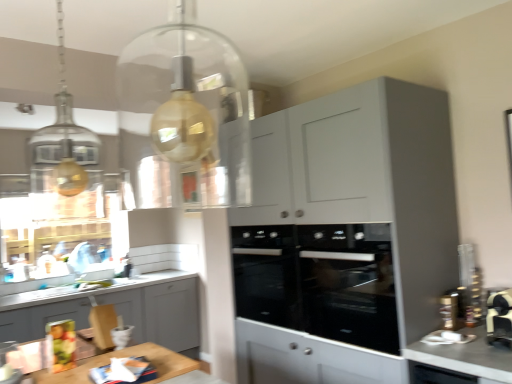
The width and height of the screenshot is (512, 384). Identify the location of matte gray cabinet at upper right, the second cabinetry in the back-to-front sequence. (345, 236).

Describe the element at coordinates (466, 357) in the screenshot. I see `white glossy countertop at lower right` at that location.

You are a GUI agent. You are given a task and a screenshot of the screen. Output one action in this format:
    pyautogui.click(x=<x>, y=<y>)
    Task: Click on the matte gray cabinet at lower left, which ranks as the 2th cabinetry in right-to-left order
    
    Given the screenshot: What is the action you would take?
    pyautogui.click(x=160, y=313)

Which of these two, black glass oven at center or white glossy countertop at lower right, stands taller?

Standing taller between the two is black glass oven at center.

Find the location of `oven on the left of white glossy countertop at lower right`. oven on the left of white glossy countertop at lower right is located at coordinates (266, 274).

Does point (244, 274) lie in front of point (483, 357)?

That is False.

Between white glossy countertop at lower right and black glass oven at center, which one is positioned in front?

white glossy countertop at lower right is closer to the camera.

Based on their sizes in the image, would you say white glossy countertop at lower right is bigger or smaller than black glass oven at center?

Clearly, white glossy countertop at lower right is smaller in size than black glass oven at center.

Where is `countertop on the right of black glass oven at center`? The height and width of the screenshot is (384, 512). countertop on the right of black glass oven at center is located at coordinates (466, 357).

Could you tell me if white glossy countertop at lower right is facing black glass oven at center?

No, white glossy countertop at lower right does not turn towards black glass oven at center.

Are black glass oven at center and matte gray cabinet at lower left, the 1th cabinetry when ordered from back to front, beside each other?

black glass oven at center and matte gray cabinet at lower left, the 1th cabinetry when ordered from back to front, are clearly separated.

Does black glass oven at center have a lesser width compared to matte gray cabinet at lower left, which ranks as the 2th cabinetry in right-to-left order?

Correct, the width of black glass oven at center is less than that of matte gray cabinet at lower left, which ranks as the 2th cabinetry in right-to-left order.

Considering the positions of objects black glass oven at center and matte gray cabinet at lower left, which ranks as the 2th cabinetry in right-to-left order, in the image provided, who is behind, black glass oven at center or matte gray cabinet at lower left, which ranks as the 2th cabinetry in right-to-left order,?

matte gray cabinet at lower left, which ranks as the 2th cabinetry in right-to-left order, is further away from the camera.

Is black glass oven at center positioned with its back to matte gray cabinet at lower left, arranged as the second cabinetry when viewed from the front?

black glass oven at center is not turned away from matte gray cabinet at lower left, arranged as the second cabinetry when viewed from the front.

Which of these two, matte gray cabinet at lower left, arranged as the second cabinetry when viewed from the front, or white glossy countertop at lower right, is thinner?

white glossy countertop at lower right is thinner.

Could you tell me if matte gray cabinet at lower left, the 1th cabinetry when ordered from back to front, is turned towards white glossy countertop at lower right?

Yes, matte gray cabinet at lower left, the 1th cabinetry when ordered from back to front, is facing white glossy countertop at lower right.

The image size is (512, 384). I want to click on cabinetry located underneath the white glossy countertop at lower right (from a real-world perspective), so pyautogui.click(x=160, y=313).

How many degrees apart are the facing directions of matte gray cabinet at lower left, arranged as the second cabinetry when viewed from the front, and white glossy countertop at lower right?

89.4 degrees.

Looking at this image, from a real-world perspective, relative to black glass oven at center, is matte gray cabinet at upper right, the second cabinetry in the back-to-front sequence, vertically above or below?

matte gray cabinet at upper right, the second cabinetry in the back-to-front sequence, is above black glass oven at center.

Identify the location of oven lying on the left of matte gray cabinet at upper right, which is the first cabinetry in right-to-left order. The width and height of the screenshot is (512, 384). (266, 274).

Can you confirm if matte gray cabinet at upper right, the second cabinetry in the back-to-front sequence, is taller than black glass oven at center?

Yes, matte gray cabinet at upper right, the second cabinetry in the back-to-front sequence, is taller than black glass oven at center.

Which is closer, (367, 354) or (253, 227)?

Point (367, 354) is closer to the camera than point (253, 227).

Does black glass oven at center come in front of matte gray cabinet at lower left, which ranks as the 2th cabinetry in right-to-left order?

That is True.

Would you say black glass oven at center is outside matte gray cabinet at lower left, the 1th cabinetry when ordered from back to front?

Indeed, black glass oven at center is completely outside matte gray cabinet at lower left, the 1th cabinetry when ordered from back to front.

Is black glass oven at center at the right side of matte gray cabinet at lower left, which ranks as the 2th cabinetry in right-to-left order?

Yes.

Is black glass oven at center facing away from matte gray cabinet at lower left, which ranks as the 2th cabinetry in right-to-left order?

Answer: No, black glass oven at center is not facing the opposite direction of matte gray cabinet at lower left, which ranks as the 2th cabinetry in right-to-left order.

Measure the distance from black glass oven at center to black glass oven at center.

black glass oven at center and black glass oven at center are 4.32 inches apart from each other.

How many degrees apart are the facing directions of black glass oven at center and black glass oven at center?

There is a 0.000527-degree angle between the facing directions of black glass oven at center and black glass oven at center.

Considering the relative sizes of black glass oven at center and black glass oven at center in the image provided, is black glass oven at center smaller than black glass oven at center?

No, black glass oven at center is not smaller than black glass oven at center.

Is black glass oven at center taller than black glass oven at center?

Incorrect, the height of black glass oven at center is not larger of that of black glass oven at center.

The image size is (512, 384). I want to click on countertop lying below the black glass oven at center (from the image's perspective), so click(466, 357).

Locate an element on the screen. This screenshot has height=384, width=512. kitchen appliance on the left of white glossy countertop at lower right is located at coordinates (319, 281).

From the image, which object appears to be nearer to black glass oven at center, matte gray cabinet at lower left, the first cabinetry viewed from the left, or white glossy countertop at lower right?

Among the two, white glossy countertop at lower right is located nearer to black glass oven at center.

Looking at the image, which one is located further to black glass oven at center, black glass oven at center or white glossy countertop at lower right?

white glossy countertop at lower right is positioned further to the anchor black glass oven at center.

Estimate the real-world distances between objects in this image. Which object is closer to black glass oven at center, matte gray cabinet at upper right, the second cabinetry in the back-to-front sequence, or matte gray cabinet at lower left, the first cabinetry viewed from the left?

Among the two, matte gray cabinet at upper right, the second cabinetry in the back-to-front sequence, is located nearer to black glass oven at center.

Considering their positions, is black glass oven at center positioned closer to matte gray cabinet at lower left, which ranks as the 2th cabinetry in right-to-left order, than white glossy countertop at lower right?

black glass oven at center.

Which object lies further to the anchor point matte gray cabinet at upper right, the second cabinetry in the back-to-front sequence, black glass oven at center or white glossy countertop at lower right?

white glossy countertop at lower right.

When comparing their distances from black glass oven at center, does matte gray cabinet at lower left, the 1th cabinetry when ordered from back to front, or white glossy countertop at lower right seem further?

matte gray cabinet at lower left, the 1th cabinetry when ordered from back to front, is further to black glass oven at center.

Which object lies nearer to the anchor point white glossy countertop at lower right, black glass oven at center or matte gray cabinet at upper right, the 1th cabinetry from the front?

black glass oven at center.

From the picture: When comparing their distances from black glass oven at center, does white glossy countertop at lower right or matte gray cabinet at upper right, the second cabinetry in the back-to-front sequence, seem further?

white glossy countertop at lower right is further to black glass oven at center.

This screenshot has width=512, height=384. Identify the location of oven between matte gray cabinet at lower left, the first cabinetry viewed from the left, and matte gray cabinet at upper right, the 1th cabinetry from the front. (266, 274).

Where is `oven between matte gray cabinet at lower left, which ranks as the 2th cabinetry in right-to-left order, and white glossy countertop at lower right from left to right`? oven between matte gray cabinet at lower left, which ranks as the 2th cabinetry in right-to-left order, and white glossy countertop at lower right from left to right is located at coordinates (266, 274).

Locate an element on the screen. cabinetry situated between black glass oven at center and white glossy countertop at lower right from left to right is located at coordinates (345, 236).

You are a GUI agent. You are given a task and a screenshot of the screen. Output one action in this format:
    pyautogui.click(x=<x>, y=<y>)
    Task: Click on the cabinetry situated between matte gray cabinet at lower left, which ranks as the 2th cabinetry in right-to-left order, and white glossy countertop at lower right from left to right
    
    Given the screenshot: What is the action you would take?
    pyautogui.click(x=345, y=236)